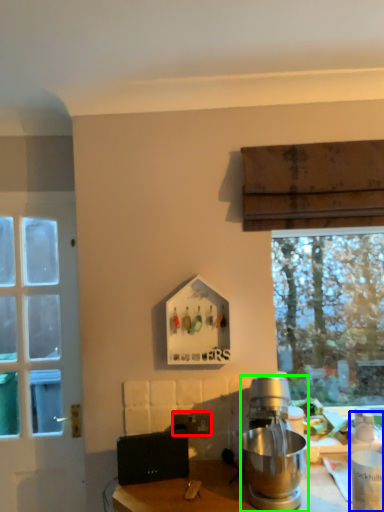
Question: Which is farther away from power outlet (highlighted by a red box)? bottle (highlighted by a blue box) or kitchen appliance (highlighted by a green box)?

Choices:
 (A) bottle
 (B) kitchen appliance

Answer: (A)